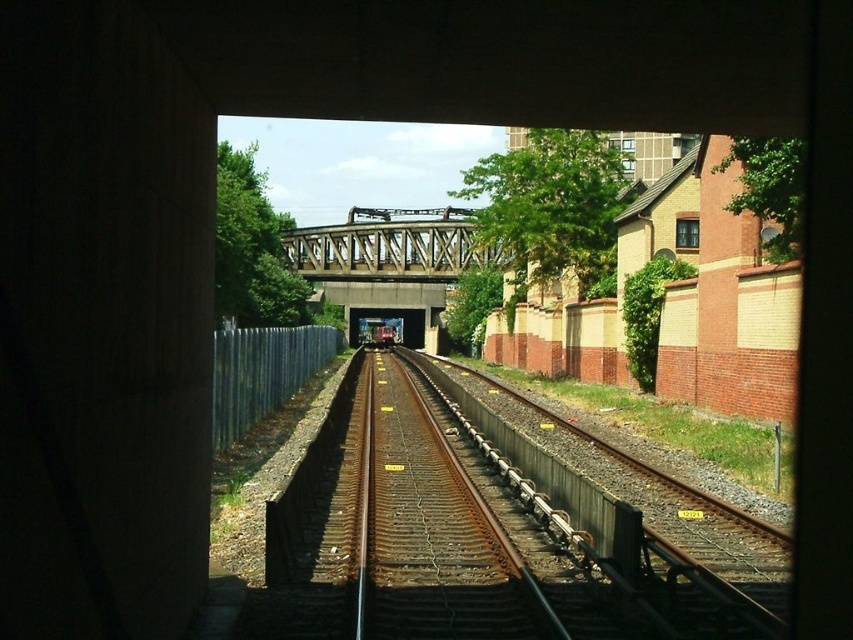
I want to click on metallic train at center, so click(389, 323).

Between metallic train at center and shiny silver train at center, which one has less height?

shiny silver train at center is shorter.

Which is behind, point (380, 308) or point (387, 323)?

The point (387, 323) is behind.

The image size is (853, 640). What are the coordinates of `metallic train at center` in the screenshot? It's located at (389, 323).

Who is positioned more to the left, metallic gray bridge at center or metallic train at center?

metallic train at center is more to the left.

This screenshot has height=640, width=853. What are the coordinates of `metallic gray bridge at center` in the screenshot? It's located at (392, 244).

Consider the image. Is rusty metal train track at center shorter than shiny silver train at center?

Yes, rusty metal train track at center is shorter than shiny silver train at center.

Which is below, rusty metal train track at center or shiny silver train at center?

rusty metal train track at center is below.

Identify the location of rusty metal train track at center. (433, 536).